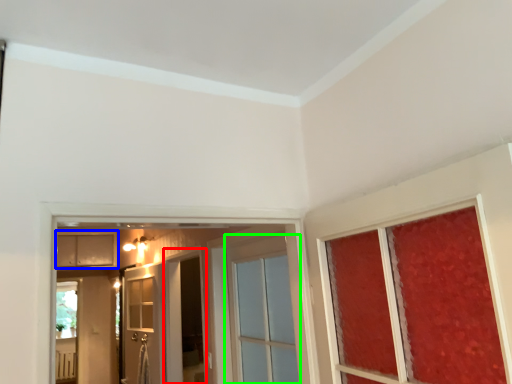
Question: Based on their relative distances, which object is nearer to screen door (highlighted by a red box)? Choose from cabinetry (highlighted by a blue box) and door (highlighted by a green box).

Choices:
 (A) cabinetry
 (B) door

Answer: (B)